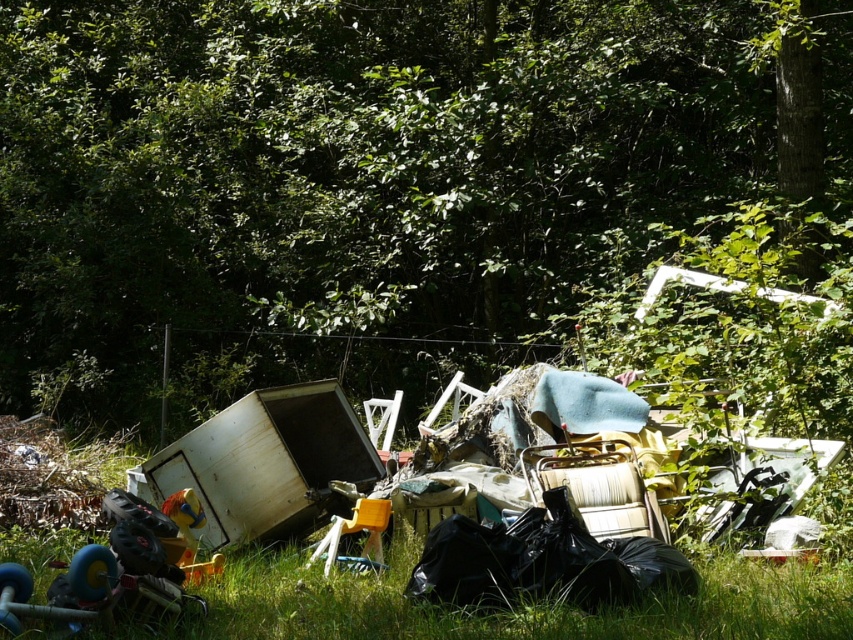
In the scene shown: Who is positioned more to the right, green leafy tree at upper center or black plastic bag at center?

Positioned to the right is green leafy tree at upper center.

Looking at this image, is green leafy tree at upper center further to camera compared to black plastic bag at center?

Yes, it is behind black plastic bag at center.

Measure the distance between point (15, 29) and camera.

Point (15, 29) is 10.05 meters from camera.

Find the location of a particular element. green leafy tree at upper center is located at coordinates (347, 179).

Can you confirm if green leafy tree at upper center is wider than green grass at lower center?

Incorrect, green leafy tree at upper center's width does not surpass green grass at lower center's.

Who is taller, green leafy tree at upper center or green grass at lower center?

With more height is green leafy tree at upper center.

This screenshot has width=853, height=640. I want to click on green leafy tree at upper center, so click(347, 179).

Does point (180, 628) come farther from viewer compared to point (624, 568)?

No, it is in front of (624, 568).

Which is behind, point (755, 620) or point (428, 550)?

Point (428, 550)

Is point (764, 611) positioned after point (413, 580)?

No, (764, 611) is in front of (413, 580).

Where is `green grass at lower center`? The height and width of the screenshot is (640, 853). green grass at lower center is located at coordinates (514, 608).